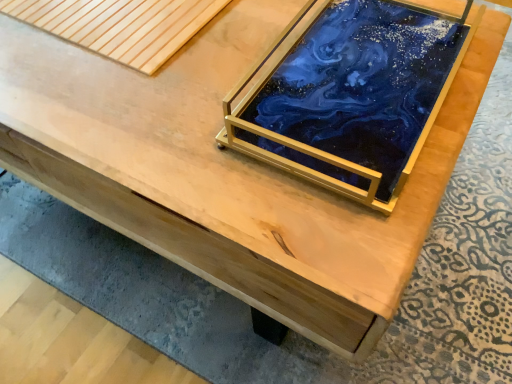
The image size is (512, 384). Find the location of `blue resin tray at center`. blue resin tray at center is located at coordinates (353, 96).

What is the approximate width of blue resin tray at center?

The width of blue resin tray at center is 43.98 centimeters.

What do you see at coordinates (353, 96) in the screenshot?
I see `blue resin tray at center` at bounding box center [353, 96].

Where is `natural wood plank at upper left`? The height and width of the screenshot is (384, 512). natural wood plank at upper left is located at coordinates (120, 25).

What do you see at coordinates (120, 25) in the screenshot? The width and height of the screenshot is (512, 384). I see `natural wood plank at upper left` at bounding box center [120, 25].

The image size is (512, 384). What are the coordinates of `blue resin tray at center` in the screenshot? It's located at (353, 96).

Consider the image. Between blue resin tray at center and natural wood plank at upper left, which one appears on the left side from the viewer's perspective?

natural wood plank at upper left.

Between blue resin tray at center and natural wood plank at upper left, which one is positioned in front?

blue resin tray at center is in front.

Between point (337, 5) and point (87, 43), which one is positioned in front?

The point (87, 43) is closer.

From the image's perspective, is blue resin tray at center located above or below natural wood plank at upper left?

Clearly, from the image's perspective, blue resin tray at center is below natural wood plank at upper left.

From a real-world perspective, is blue resin tray at center located beneath natural wood plank at upper left?

No, from a real-world perspective, blue resin tray at center is not under natural wood plank at upper left.

Does blue resin tray at center have a lesser width compared to natural wood plank at upper left?

No, blue resin tray at center is not thinner than natural wood plank at upper left.

Considering the sizes of blue resin tray at center and natural wood plank at upper left in the image, is blue resin tray at center taller or shorter than natural wood plank at upper left?

Clearly, blue resin tray at center is taller compared to natural wood plank at upper left.

Can you confirm if blue resin tray at center is smaller than natural wood plank at upper left?

No.

Is natural wood plank at upper left inside blue resin tray at center?

Actually, natural wood plank at upper left is outside blue resin tray at center.

Would you say blue resin tray at center is a long distance from natural wood plank at upper left?

blue resin tray at center is actually quite close to natural wood plank at upper left.

Is blue resin tray at center oriented away from natural wood plank at upper left?

No, blue resin tray at center's orientation is not away from natural wood plank at upper left.

Find the location of a particular element. plank that appears below the blue resin tray at center (from a real-world perspective) is located at coordinates (120, 25).

Considering the relative positions of natural wood plank at upper left and blue resin tray at center in the image provided, is natural wood plank at upper left to the right of blue resin tray at center from the viewer's perspective?

No, natural wood plank at upper left is not to the right of blue resin tray at center.

Is natural wood plank at upper left closer to the viewer compared to blue resin tray at center?

That is False.

Does point (172, 31) lie in front of point (227, 132)?

No, (172, 31) is behind (227, 132).

From the image's perspective, is natural wood plank at upper left beneath blue resin tray at center?

Actually, natural wood plank at upper left appears above blue resin tray at center in the image.

From a real-world perspective, is natural wood plank at upper left under blue resin tray at center?

Indeed, from a real-world perspective, natural wood plank at upper left is positioned beneath blue resin tray at center.

Considering the relative sizes of natural wood plank at upper left and blue resin tray at center in the image provided, is natural wood plank at upper left wider than blue resin tray at center?

In fact, natural wood plank at upper left might be narrower than blue resin tray at center.

Is natural wood plank at upper left taller than blue resin tray at center?

No, natural wood plank at upper left is not taller than blue resin tray at center.

Is natural wood plank at upper left bigger than blue resin tray at center?

Actually, natural wood plank at upper left might be smaller than blue resin tray at center.

Is natural wood plank at upper left inside or outside of blue resin tray at center?

natural wood plank at upper left is not enclosed by blue resin tray at center.

Is natural wood plank at upper left directly adjacent to blue resin tray at center?

No, natural wood plank at upper left is not beside blue resin tray at center.

From the picture: Is natural wood plank at upper left turned away from blue resin tray at center?

That's not correct — natural wood plank at upper left is not looking away from blue resin tray at center.

Can you tell me how much natural wood plank at upper left and blue resin tray at center differ in facing direction?

They differ by 0.00241 degrees in their facing directions.

Image resolution: width=512 pixels, height=384 pixels. Identify the location of glass box above the natural wood plank at upper left (from a real-world perspective). (353, 96).

Image resolution: width=512 pixels, height=384 pixels. What are the coordinates of `glass box below the natural wood plank at upper left (from the image's perspective)` in the screenshot? It's located at (353, 96).

You are a GUI agent. You are given a task and a screenshot of the screen. Output one action in this format:
    pyautogui.click(x=<x>, y=<y>)
    Task: Click on the plank above the blue resin tray at center (from the image's perspective)
    The height and width of the screenshot is (384, 512).
    Given the screenshot: What is the action you would take?
    pyautogui.click(x=120, y=25)